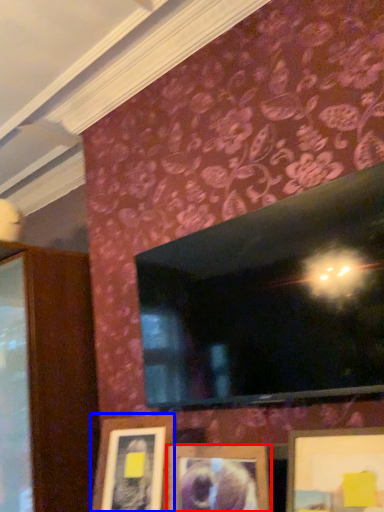
Question: Which object appears farthest to the camera in this image, picture frame (highlighted by a red box) or picture frame (highlighted by a blue box)?

Choices:
 (A) picture frame
 (B) picture frame

Answer: (B)